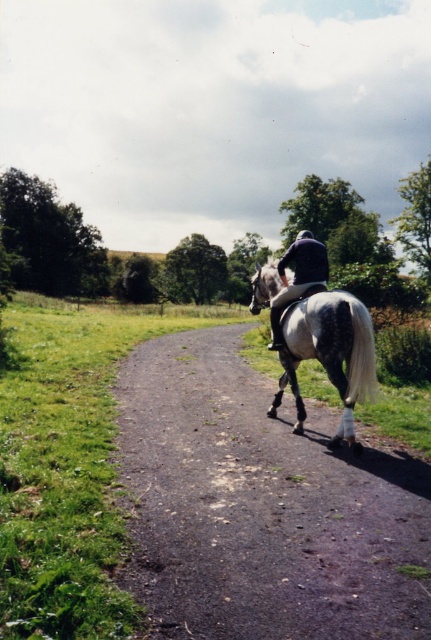
Does gray/white horse at center have a larger size compared to gray speckled horse at center?

Yes, gray/white horse at center is bigger than gray speckled horse at center.

What do you see at coordinates (262, 506) in the screenshot?
I see `gray/white horse at center` at bounding box center [262, 506].

Image resolution: width=431 pixels, height=640 pixels. What do you see at coordinates (262, 506) in the screenshot?
I see `gray/white horse at center` at bounding box center [262, 506].

The image size is (431, 640). What are the coordinates of `gray/white horse at center` in the screenshot? It's located at (262, 506).